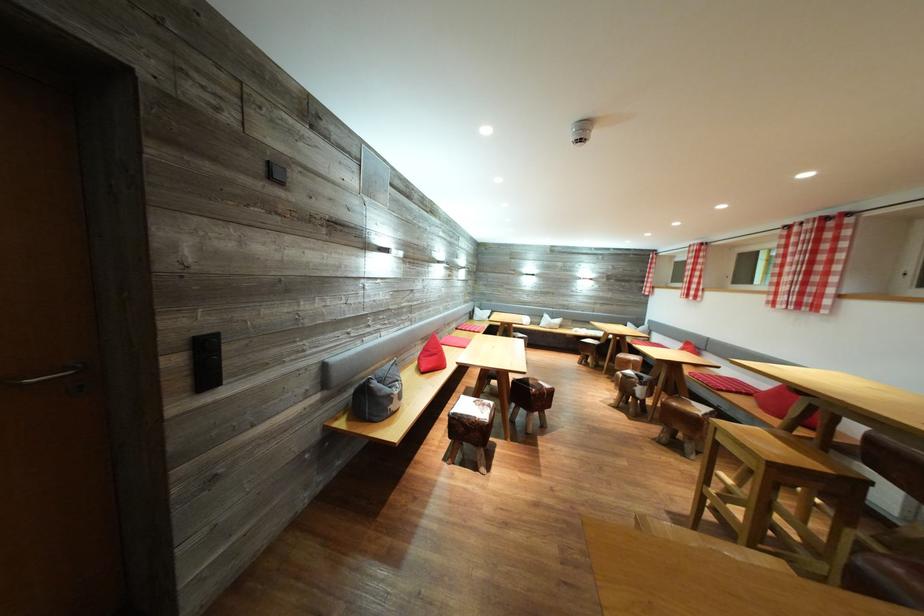
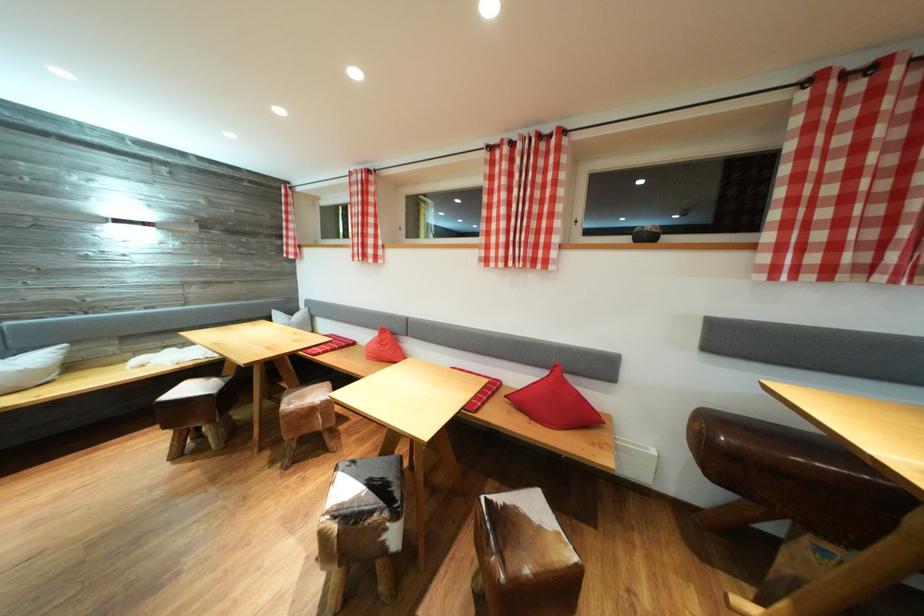
In the second image, find the point that corresponds to point 648,390 in the first image.

(403, 522)